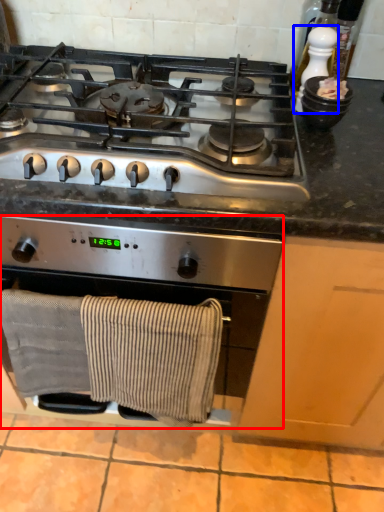
Question: Which object is further to the camera taking this photo, kitchen appliance (highlighted by a red box) or appliance (highlighted by a blue box)?

Choices:
 (A) kitchen appliance
 (B) appliance

Answer: (B)